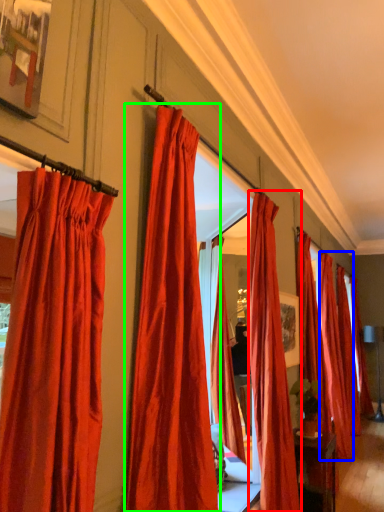
Question: Considering the real-world distances, which object is farthest from curtain (highlighted by a red box)? curtain (highlighted by a blue box) or curtain (highlighted by a green box)?

Choices:
 (A) curtain
 (B) curtain

Answer: (A)